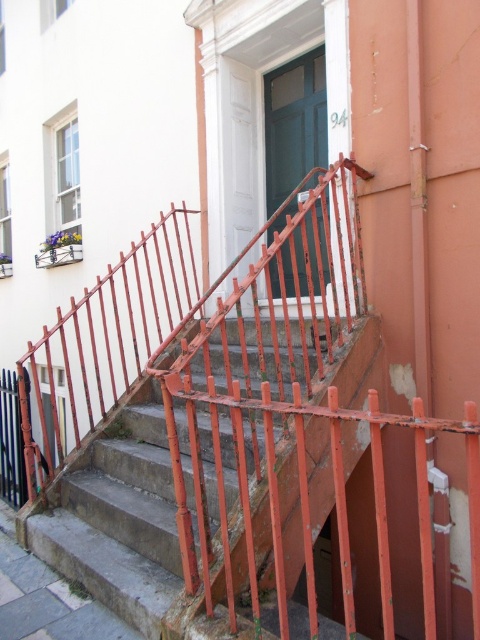
You are a painter hired to paint the rusty metal railing at center and the green glossy door at center. You need to know which one is closer to the ground. Can you tell me?

The rusty metal railing at center is positioned under the green glossy door at center, so the rusty metal railing at center is closer to the ground.

You are a painter hired to paint the exterior of the building. You need to determine which object requires more paint based on their sizes. Which one between the rusty metal railing at center and the green glossy door at center needs more paint?

The rusty metal railing at center is larger in size than the green glossy door at center, so it requires more paint.